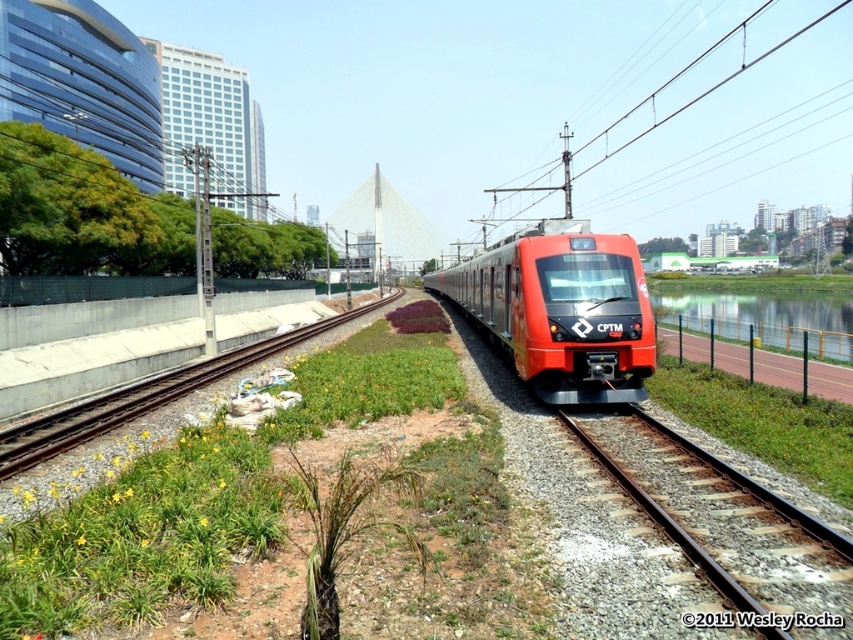
You are standing on the sidewalk near the construction materials and want to walk to the point marked as point (456, 291) and point (9, 460). Which point should you reach first if you walk straight towards the train?

You should reach point (456, 291) first because it is closer to you than point (9, 460), which is further away from your current position on the sidewalk.

Looking at this image, you are standing on the sidewalk to the left of the railway tracks and want to take a photo of the shiny orange train at center. Based on its position, which direction should you face to capture the train in your shot?

The shiny orange train at center is positioned centrally in the frame, moving towards the viewer. Since you are on the sidewalk to the left of the tracks, you should face towards the center of the tracks to capture the train in your photo.